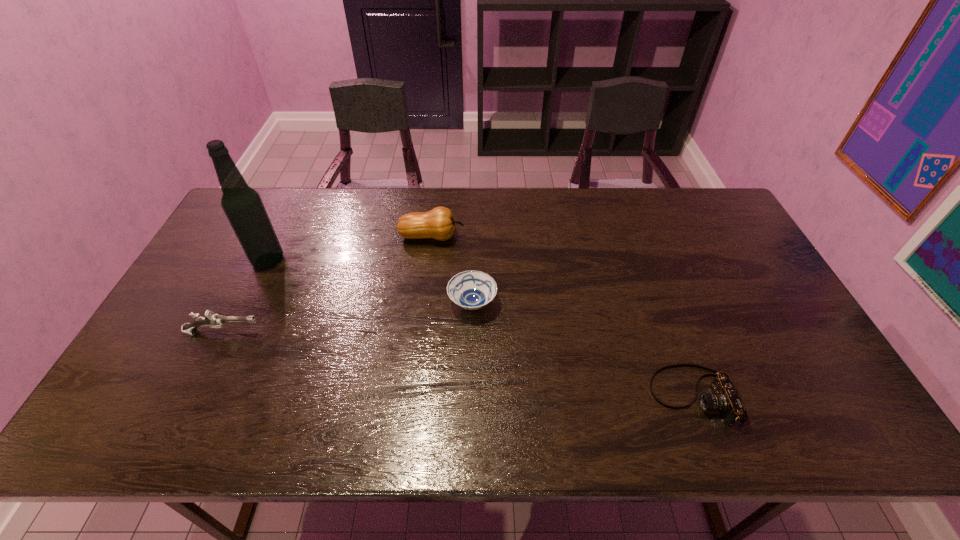
Locate an element on the screen. This screenshot has width=960, height=540. free space between the camera and the soup bowl is located at coordinates (584, 349).

Image resolution: width=960 pixels, height=540 pixels. I want to click on unoccupied area between the gun and the gourd, so click(x=327, y=285).

Identify the location of free space between the second farthest object and the nearest object. This screenshot has height=540, width=960. (481, 328).

Where is `vacant space that is in between the nearest object and the gun`? Image resolution: width=960 pixels, height=540 pixels. vacant space that is in between the nearest object and the gun is located at coordinates (459, 364).

Identify the location of vacant region between the camera and the farthest object. The height and width of the screenshot is (540, 960). (564, 316).

At what (x,y) coordinates should I click in order to perform the action: click on object that ranks as the closest to the third shortest object. Please return your answer as a coordinate pair (x, y). Image resolution: width=960 pixels, height=540 pixels. Looking at the image, I should click on (243, 206).

Locate which object ranks second in proximity to the rightmost object. Please provide its 2D coordinates. Your answer should be formatted as a tuple, i.e. [(x, y)], where the tuple contains the x and y coordinates of a point satisfying the conditions above.

[(438, 223)]

Where is `vacant position in the image that satisfies the following two spatial constraints: 1. on the back side of the third farthest object; 2. on the stem side of the second tallest object`? The image size is (960, 540). vacant position in the image that satisfies the following two spatial constraints: 1. on the back side of the third farthest object; 2. on the stem side of the second tallest object is located at coordinates (473, 237).

Identify the location of vacant space that satisfies the following two spatial constraints: 1. on the stem side of the farthest object; 2. on the right side of the soup bowl. (424, 303).

Locate an element on the screen. The height and width of the screenshot is (540, 960). free spot that satisfies the following two spatial constraints: 1. on the stem side of the second tallest object; 2. on the back side of the third nearest object is located at coordinates (424, 303).